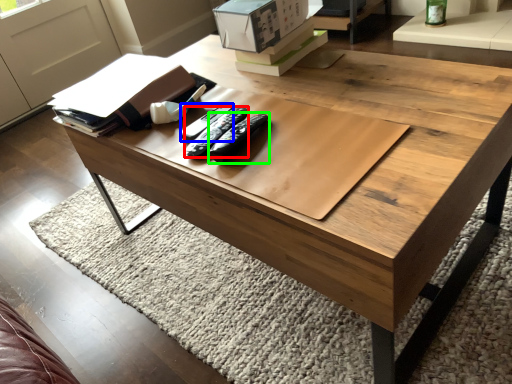
Question: Based on their relative distances, which object is nearer to remote (highlighted by a red box)? Choose from remote (highlighted by a blue box) and remote (highlighted by a green box).

Choices:
 (A) remote
 (B) remote

Answer: (A)